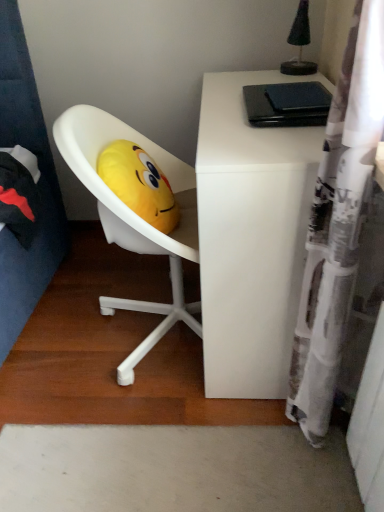
Question: Looking at their shapes, would you say white printed fabric shower curtain at right is wider or thinner than yellow plush at center?

Choices:
 (A) wide
 (B) thin

Answer: (B)

Question: From their relative heights in the image, would you say white printed fabric shower curtain at right is taller or shorter than yellow plush at center?

Choices:
 (A) tall
 (B) short

Answer: (A)

Question: Estimate the real-world distances between objects in this image. Which object is farther from the white matte desk at upper right?

Choices:
 (A) yellow plush at center
 (B) white printed fabric shower curtain at right

Answer: (A)

Question: Which object is positioned closest to the white matte desk at upper right?

Choices:
 (A) white printed fabric shower curtain at right
 (B) yellow plush at center

Answer: (A)